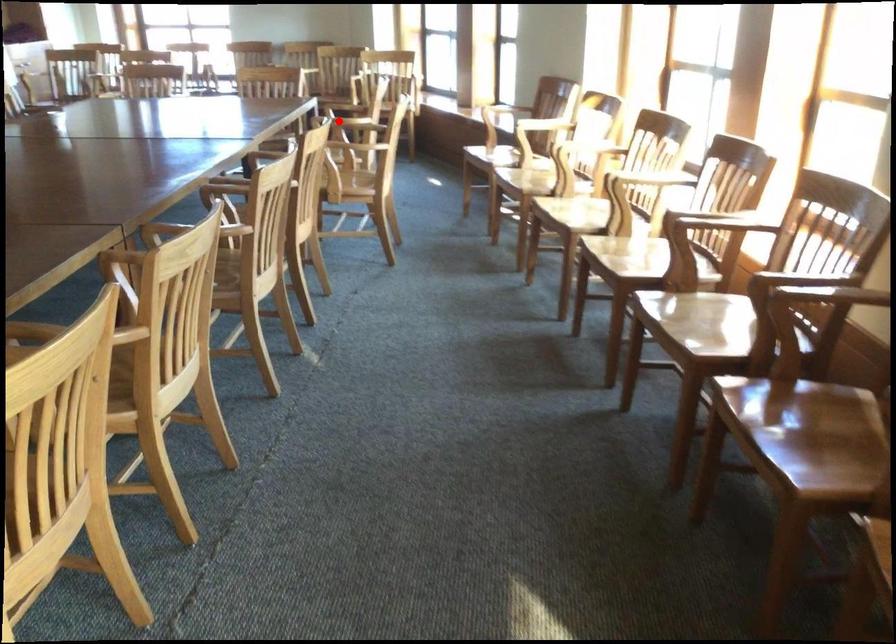
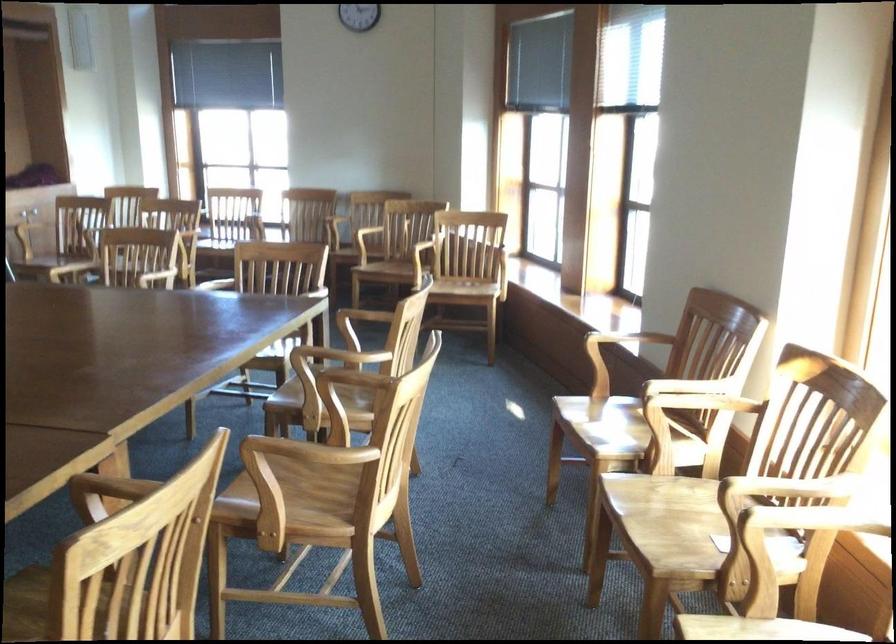
Question: I am providing you with two images of the same scene from different viewpoints. Given a red point in image1, look at the same physical point in image2. Is it:

Choices:
 (A) Closer to the viewpoint
 (B) Farther from the viewpoint

Answer: (A)